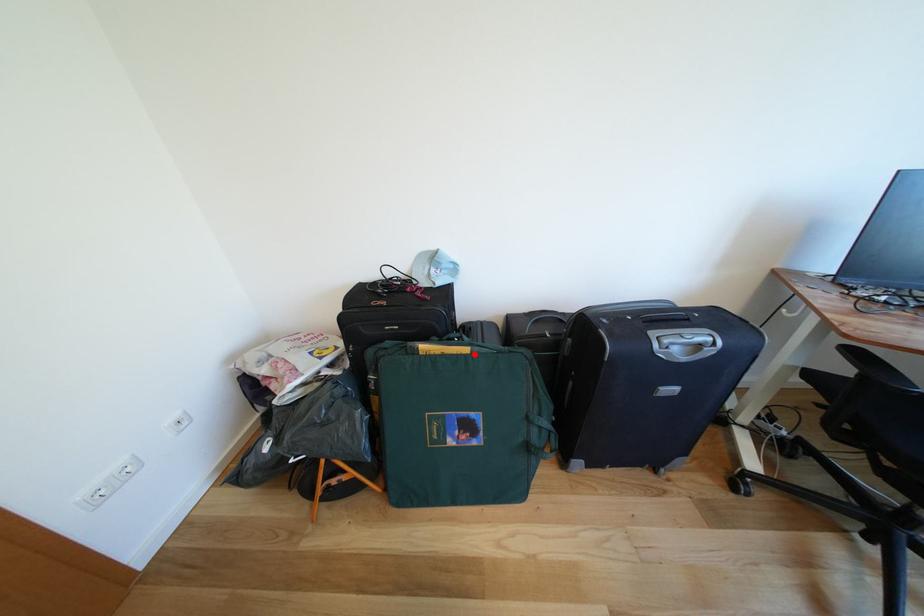
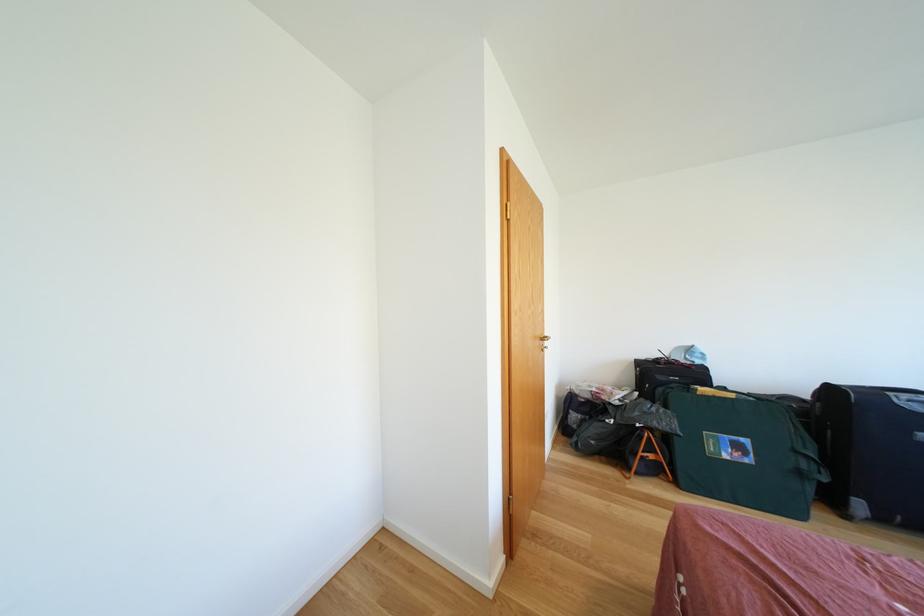
Question: I am providing you with two images of the same scene from different viewpoints. Given a red point in image1, look at the same physical point in image2. Is it:

Choices:
 (A) Closer to the viewpoint
 (B) Farther from the viewpoint

Answer: (B)